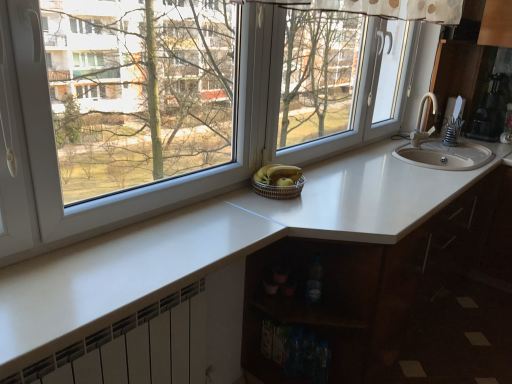
Question: From a real-world perspective, does transparent glass window at center stand above white glossy countertop at center?

Choices:
 (A) yes
 (B) no

Answer: (A)

Question: Does transparent glass window at center have a smaller size compared to white glossy countertop at center?

Choices:
 (A) yes
 (B) no

Answer: (A)

Question: From the image's perspective, would you say transparent glass window at center is positioned over white glossy countertop at center?

Choices:
 (A) yes
 (B) no

Answer: (A)

Question: Is transparent glass window at center completely or partially outside of white glossy countertop at center?

Choices:
 (A) yes
 (B) no

Answer: (A)

Question: Could white glossy countertop at center be considered to be inside transparent glass window at center?

Choices:
 (A) no
 (B) yes

Answer: (A)

Question: Based on their positions, is transparent glass window at center located to the left or right of white glossy countertop at center?

Choices:
 (A) left
 (B) right

Answer: (A)

Question: In the image, is transparent glass window at center positioned in front of or behind white glossy countertop at center?

Choices:
 (A) behind
 (B) front

Answer: (B)

Question: From a real-world perspective, is transparent glass window at center physically located above or below white glossy countertop at center?

Choices:
 (A) above
 (B) below

Answer: (A)

Question: Considering the positions of point (40, 112) and point (400, 268), is point (40, 112) closer or farther from the camera than point (400, 268)?

Choices:
 (A) farther
 (B) closer

Answer: (B)

Question: In terms of width, does white metallic radiator at lower left look wider or thinner when compared to transparent glass window at center?

Choices:
 (A) thin
 (B) wide

Answer: (A)

Question: From their relative heights in the image, would you say white metallic radiator at lower left is taller or shorter than transparent glass window at center?

Choices:
 (A) short
 (B) tall

Answer: (A)

Question: Which is correct: white metallic radiator at lower left is inside transparent glass window at center, or outside of it?

Choices:
 (A) outside
 (B) inside

Answer: (A)

Question: Is white metallic radiator at lower left in front of or behind transparent glass window at center in the image?

Choices:
 (A) behind
 (B) front

Answer: (A)

Question: Is white glossy countertop at center bigger or smaller than woven brown basket at center?

Choices:
 (A) small
 (B) big

Answer: (B)

Question: Considering the positions of white glossy countertop at center and woven brown basket at center in the image, is white glossy countertop at center taller or shorter than woven brown basket at center?

Choices:
 (A) tall
 (B) short

Answer: (A)